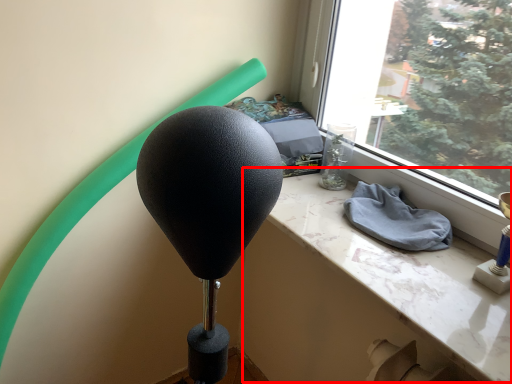
Question: From the image, what is the correct spatial relationship of table (annotated by the red box) in relation to cloth?

Choices:
 (A) right
 (B) left

Answer: (B)